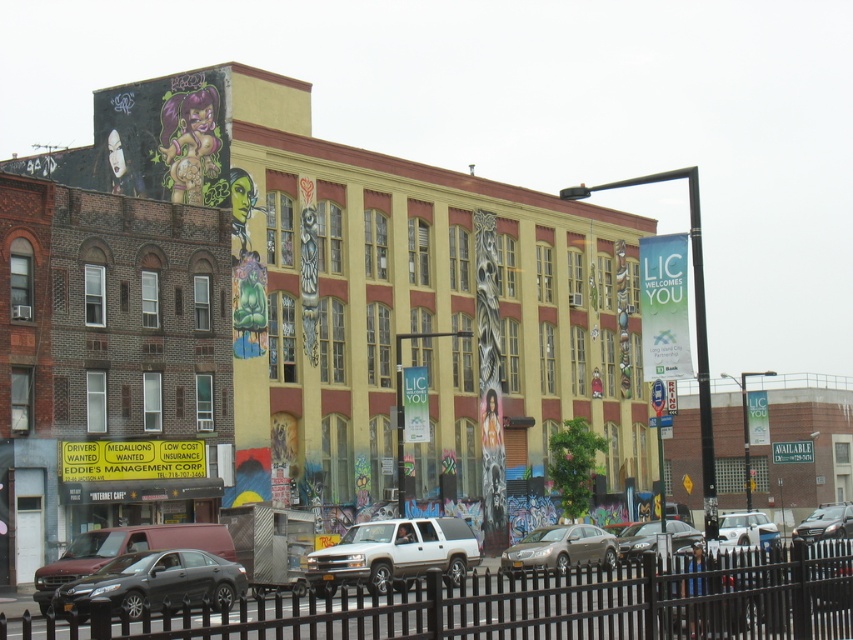
Question: Is matte black sedan at lower left to the right of white matte car at lower right from the viewer's perspective?

Choices:
 (A) yes
 (B) no

Answer: (B)

Question: Which object appears closest to the camera in this image?

Choices:
 (A) silver metallic suv at center
 (B) silver metallic sedan at center
 (C) matte black sedan at lower left
 (D) white matte car at lower right

Answer: (D)

Question: Where is metallic silver sedan at center located in relation to white matte car at lower right in the image?

Choices:
 (A) above
 (B) below

Answer: (B)

Question: Which object appears farthest from the camera in this image?

Choices:
 (A) metallic silver sedan at center
 (B) white matte car at lower right
 (C) matte black sedan at lower left

Answer: (A)

Question: Is black metal fence at lower center thinner than silver metallic suv at center?

Choices:
 (A) yes
 (B) no

Answer: (B)

Question: Among these objects, which one is farthest from the camera?

Choices:
 (A) silver metallic suv at center
 (B) black metal fence at lower center
 (C) metallic silver sedan at center
 (D) silver metallic sedan at center

Answer: (D)